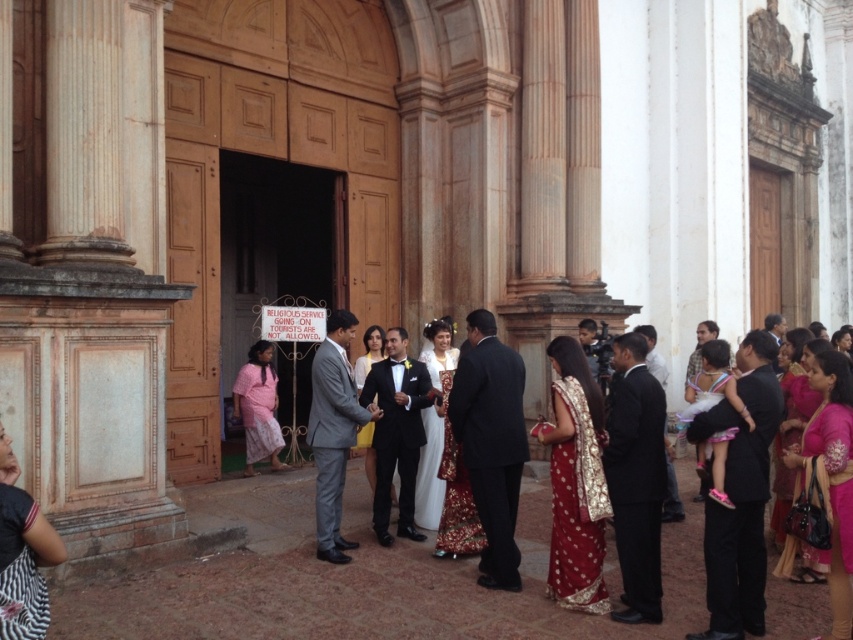
What is the position of the point with coordinates [575,483] in relation to the red silk saree at center?

The point with coordinates [575,483] is located on the red silk saree at center.

What are the coordinates of the black satin suit at right in the image?

The coordinates of the black satin suit at right are at point (636,477).